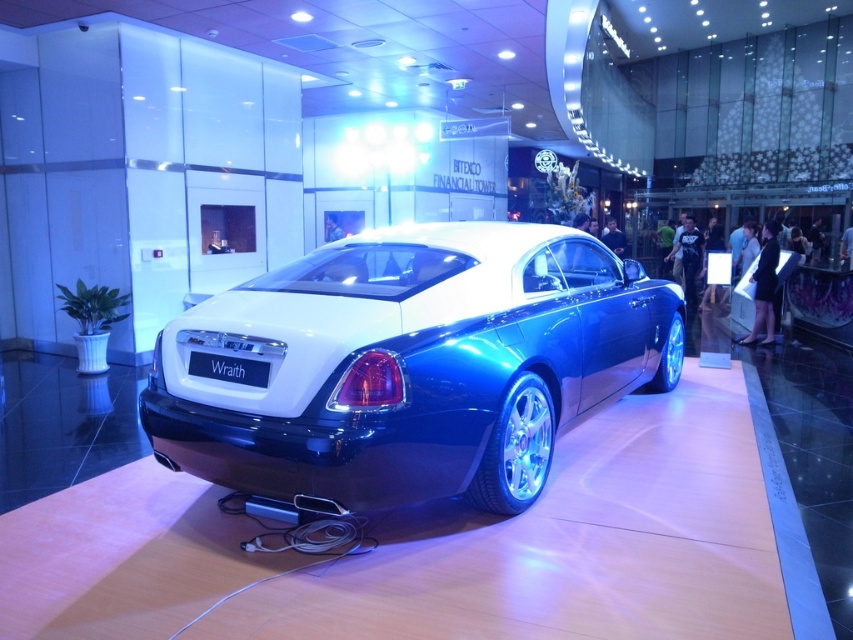
You are a photographer taking pictures of the metallic blue car at center and the black matte license plate at rear. Which object should you focus on first if you want to capture both in a single shot without moving the camera?

The metallic blue car at center is located above the black matte license plate at rear, so you should focus on the metallic blue car at center first to ensure both are in frame.

You are a delivery person who needs to place a small package on the trunk of the metallic blue car at center. The package requires a 4.2 feet clearance to avoid hitting the black matte license plate at rear. Can you safely place the package without damaging the license plate?

The distance between the metallic blue car at center and the black matte license plate at rear is 4.33 feet. Since the required clearance is 4.2 feet, there is enough space to safely place the package without damaging the license plate.